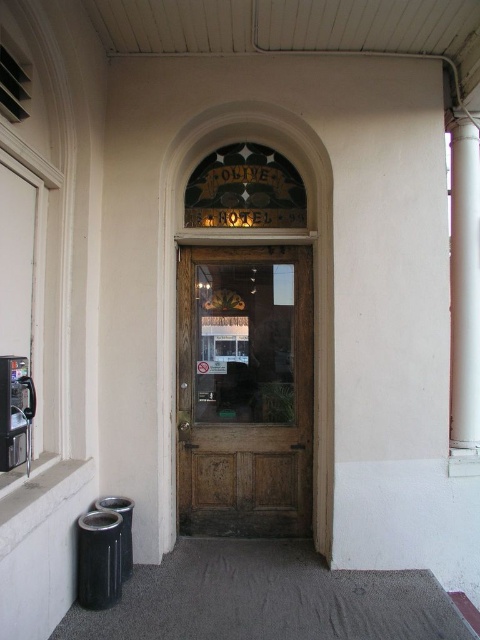
Which of these two, wooden door at center or white smooth pillar at right, stands taller?

white smooth pillar at right

Is wooden door at center in front of white smooth pillar at right?

No, wooden door at center is behind white smooth pillar at right.

Who is more distant from viewer, (x=242, y=464) or (x=457, y=260)?

Positioned behind is point (x=242, y=464).

The height and width of the screenshot is (640, 480). In order to click on wooden door at center in this screenshot , I will do `click(244, 390)`.